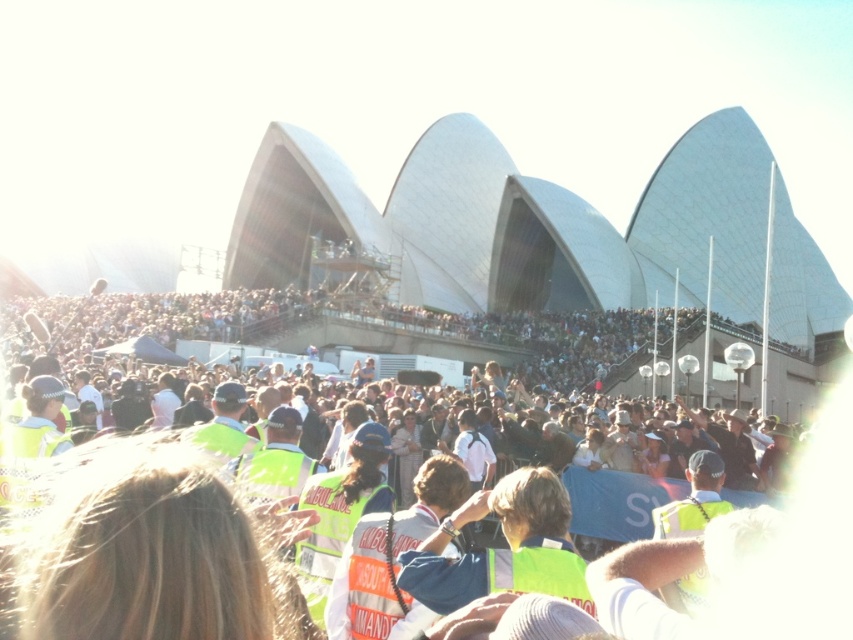
You are standing in front of the Sydney Opera House and want to reach a specific point marked at coordinates point (689, 525). If your current position is 60 meters away from that point, can you walk directly to it without moving closer than 60 meters?

The distance of point (689, 525) from viewer is 62.17 meters, so if you are currently 60 meters away, you need to move forward approximately 2.17 meters to reach it. However, this would bring you closer than 60 meters, so you cannot walk directly to it without moving closer than 60 meters.

You are a photographer standing in front of the Sydney Opera House. You notice a green reflective vest at center and a reflective orange vest at center in the crowd. Which vest is closer to you?

The green reflective vest at center is closer to you because it is positioned in front of the reflective orange vest at center.

You are a photographer trying to capture a clear shot of the Sydney Opera House. You notice two groups of people wearing yellow reflective vests at center and reflective orange safety vest at center. Which group is blocking your view more directly?

The yellow reflective vests at center are positioned over reflective orange safety vest at center, so the yellow reflective vests at center are blocking the view more directly since they are in a higher position.